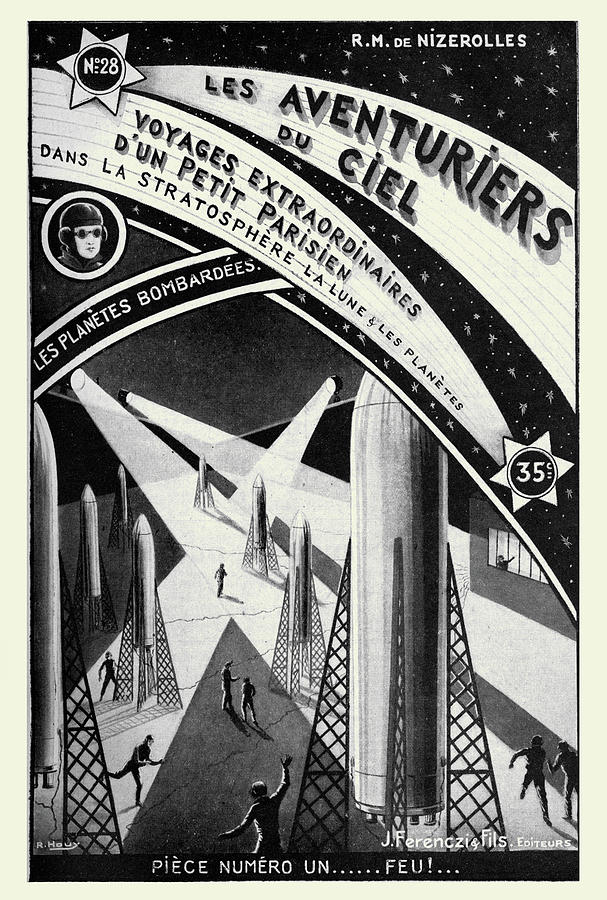
Locate an element on the screen. The height and width of the screenshot is (900, 607). windows is located at coordinates (519, 567), (506, 564), (541, 571), (489, 534).